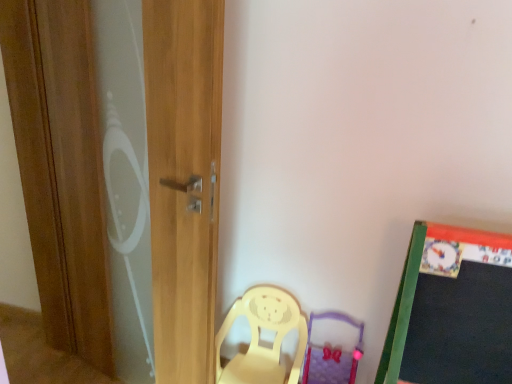
You are a GUI agent. You are given a task and a screenshot of the screen. Output one action in this format:
    pyautogui.click(x=<x>, y=<y>)
    Task: Click on the purple fabric swivel chair at lower center
    
    Given the screenshot: What is the action you would take?
    pyautogui.click(x=331, y=356)

Describe the element at coordinates (183, 179) in the screenshot. I see `wooden screen door at left` at that location.

You are a GUI agent. You are given a task and a screenshot of the screen. Output one action in this format:
    pyautogui.click(x=<x>, y=<y>)
    Task: Click on the purple fabric swivel chair at lower center
    
    Given the screenshot: What is the action you would take?
    pyautogui.click(x=331, y=356)

Which is correct: purple fabric swivel chair at lower center is inside yellow plastic chair at lower center, or outside of it?

purple fabric swivel chair at lower center exists outside the volume of yellow plastic chair at lower center.

Where is `swivel chair on the right of yellow plastic chair at lower center`? swivel chair on the right of yellow plastic chair at lower center is located at coordinates (331, 356).

Is purple fabric swivel chair at lower center aimed at yellow plastic chair at lower center?

No.

Is yellow plastic chair at lower center looking in the opposite direction of purple fabric swivel chair at lower center?

No, yellow plastic chair at lower center is not facing the opposite direction of purple fabric swivel chair at lower center.

Considering the positions of point (249, 359) and point (329, 357), is point (249, 359) closer or farther from the camera than point (329, 357)?

Point (249, 359).

Considering the sizes of objects yellow plastic chair at lower center and purple fabric swivel chair at lower center in the image provided, who is smaller, yellow plastic chair at lower center or purple fabric swivel chair at lower center?

With smaller size is purple fabric swivel chair at lower center.

How many degrees apart are the facing directions of yellow plastic chair at lower center and purple fabric swivel chair at lower center?

The angle between the facing direction of yellow plastic chair at lower center and the facing direction of purple fabric swivel chair at lower center is 1.2 degrees.

The width and height of the screenshot is (512, 384). I want to click on chair that is behind the wooden screen door at left, so click(x=260, y=335).

From the image's perspective, who appears lower, yellow plastic chair at lower center or wooden screen door at left?

yellow plastic chair at lower center.

Considering the positions of objects yellow plastic chair at lower center and wooden screen door at left in the image provided, who is more to the left, yellow plastic chair at lower center or wooden screen door at left?

From the viewer's perspective, wooden screen door at left appears more on the left side.

Does yellow plastic chair at lower center have a greater height compared to wooden screen door at left?

In fact, yellow plastic chair at lower center may be shorter than wooden screen door at left.

Is purple fabric swivel chair at lower center positioned in front of wooden screen door at left?

No, purple fabric swivel chair at lower center is further to the viewer.

Does purple fabric swivel chair at lower center contain wooden screen door at left?

No, wooden screen door at left is not inside purple fabric swivel chair at lower center.

Considering the sizes of objects purple fabric swivel chair at lower center and wooden screen door at left in the image provided, who is smaller, purple fabric swivel chair at lower center or wooden screen door at left?

With smaller size is purple fabric swivel chair at lower center.

In the scene shown: Does purple fabric swivel chair at lower center have a lesser width compared to wooden screen door at left?

Incorrect, the width of purple fabric swivel chair at lower center is not less than that of wooden screen door at left.

How different are the orientations of wooden screen door at left and yellow plastic chair at lower center in degrees?

The facing directions of wooden screen door at left and yellow plastic chair at lower center are 20.4 degrees apart.

Is wooden screen door at left facing towards yellow plastic chair at lower center?

No, wooden screen door at left does not turn towards yellow plastic chair at lower center.

Considering the positions of objects wooden screen door at left and yellow plastic chair at lower center in the image provided, who is in front, wooden screen door at left or yellow plastic chair at lower center?

wooden screen door at left is closer to the camera.

Are wooden screen door at left and yellow plastic chair at lower center far apart?

They are positioned close to each other.

How different are the orientations of wooden screen door at left and purple fabric swivel chair at lower center in degrees?

There is a 21.6-degree angle between the facing directions of wooden screen door at left and purple fabric swivel chair at lower center.

Is wooden screen door at left next to purple fabric swivel chair at lower center?

No, wooden screen door at left is not beside purple fabric swivel chair at lower center.

Based on the photo, which object is positioned more to the left, wooden screen door at left or purple fabric swivel chair at lower center?

Positioned to the left is wooden screen door at left.

Is wooden screen door at left smaller than purple fabric swivel chair at lower center?

Actually, wooden screen door at left might be larger than purple fabric swivel chair at lower center.

This screenshot has height=384, width=512. I want to click on swivel chair that appears on the right of yellow plastic chair at lower center, so click(x=331, y=356).

Image resolution: width=512 pixels, height=384 pixels. In the image, there is a yellow plastic chair at lower center. In order to click on swivel chair below it (from a real-world perspective) in this screenshot , I will do `click(331, 356)`.

Estimate the real-world distances between objects in this image. Which object is further from yellow plastic chair at lower center, purple fabric swivel chair at lower center or wooden screen door at left?

wooden screen door at left is positioned further to the anchor yellow plastic chair at lower center.

Looking at the image, which one is located further to purple fabric swivel chair at lower center, yellow plastic chair at lower center or wooden screen door at left?

wooden screen door at left lies further to purple fabric swivel chair at lower center than the other object.

Estimate the real-world distances between objects in this image. Which object is closer to wooden screen door at left, yellow plastic chair at lower center or purple fabric swivel chair at lower center?

yellow plastic chair at lower center.

Estimate the real-world distances between objects in this image. Which object is closer to wooden screen door at left, purple fabric swivel chair at lower center or yellow plastic chair at lower center?

yellow plastic chair at lower center is positioned closer to the anchor wooden screen door at left.

Looking at the image, which one is located further to yellow plastic chair at lower center, wooden screen door at left or purple fabric swivel chair at lower center?

wooden screen door at left.

Which object lies nearer to the anchor point purple fabric swivel chair at lower center, wooden screen door at left or yellow plastic chair at lower center?

yellow plastic chair at lower center lies closer to purple fabric swivel chair at lower center than the other object.

Locate an element on the screen. Image resolution: width=512 pixels, height=384 pixels. chair between wooden screen door at left and purple fabric swivel chair at lower center in the horizontal direction is located at coordinates (260, 335).